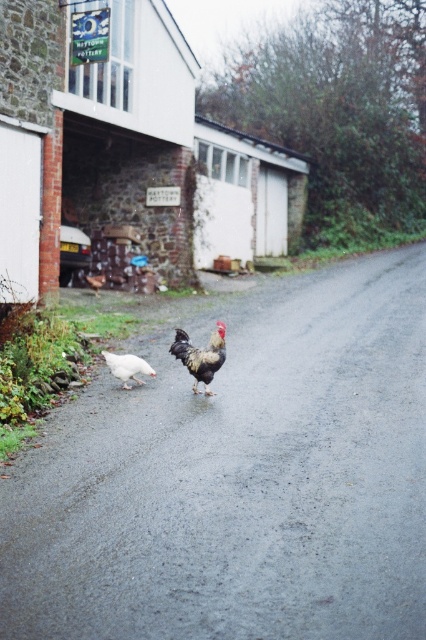
Looking at this image, you are a photographer trying to capture both the black glossy rooster at center and the white matte chicken at lower left in a single shot. Which chicken should you focus on first to ensure both are in frame?

You should focus on the white matte chicken at lower left first because the black glossy rooster at center is above it, so adjusting the camera angle to include the lower chicken will naturally include the one above.

Which chicken is larger in size between the black glossy rooster at center and the white matte chicken at lower left?

The black glossy rooster at center is bigger than the white matte chicken at lower left.